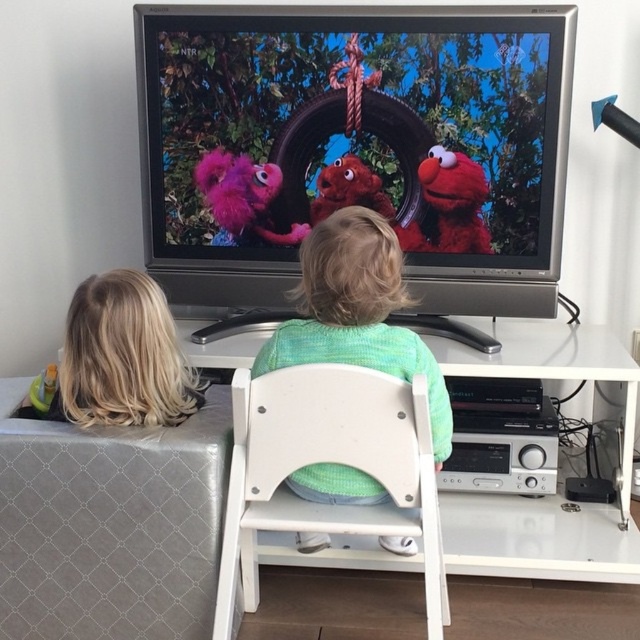
Based on the photo, you are a delivery robot with a package that needs to be placed at point (x=326, y=390). The robot can only move forward and backward, and its maximum reach is 1.5 meters. Can you place the package at the specified point?

The distance of point (x=326, y=390) from camera is 1.46 meters, so yes, the robot can place the package there since it is within the maximum reach of 1.5 meters.

You are a photographer trying to capture a photo of the two children watching TV. You notice the blonde hair at left and the fuzzy pink plush at upper left. Which object should you focus on first if you want to ensure both are in the frame?

The blonde hair at left is positioned on the left side of the fuzzy pink plush at upper left, so focusing on the blonde hair at left first will ensure both objects remain in the frame as you adjust the camera.

You are a photographer trying to capture a photo of the children watching the TV. The camera is positioned at the center of the image. Which direction should you move the camera to focus on the blonde hair at left?

The blonde hair at left is located at point (120,356), so you should move the camera to the left and slightly downward to focus on it.